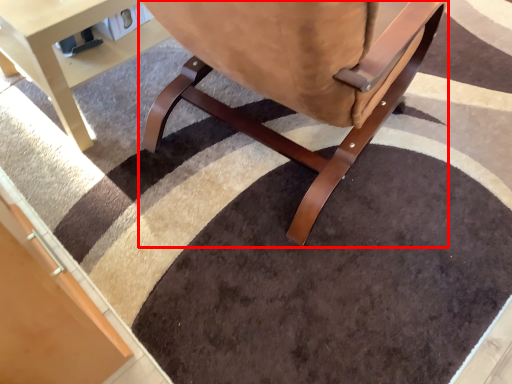
Question: In this image, where is chair (annotated by the red box) located relative to table?

Choices:
 (A) left
 (B) right

Answer: (B)